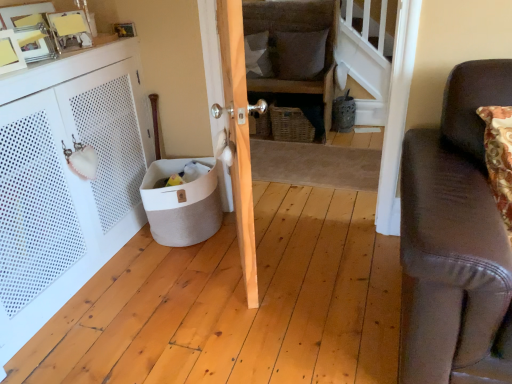
Question: From the image's perspective, is beige fabric basket at lower left positioned above or below textured gray pillow at upper center, which appears as the 1th pillow when viewed from the left?

Choices:
 (A) above
 (B) below

Answer: (B)

Question: From a real-world perspective, is beige fabric basket at lower left physically located above or below textured gray pillow at upper center, marked as the 2th pillow in a right-to-left arrangement?

Choices:
 (A) above
 (B) below

Answer: (B)

Question: Which is nearer to the woven brown basket at center?

Choices:
 (A) beige fabric basket at lower left
 (B) white fabric pillow at center, the 2th pillow viewed from the left
 (C) woven wicker basket at center
 (D) white perforated cabinet at left
 (E) textured gray pillow at upper center, which appears as the 1th pillow when viewed from the left

Answer: (C)

Question: Which object is the farthest from the beige fabric basket at lower left?

Choices:
 (A) white fabric pillow at center, which is counted as the 1th pillow, starting from the right
 (B) woven brown basket at center
 (C) wooden door at center
 (D) textured gray pillow at upper center, which appears as the 1th pillow when viewed from the left
 (E) white perforated cabinet at left

Answer: (A)